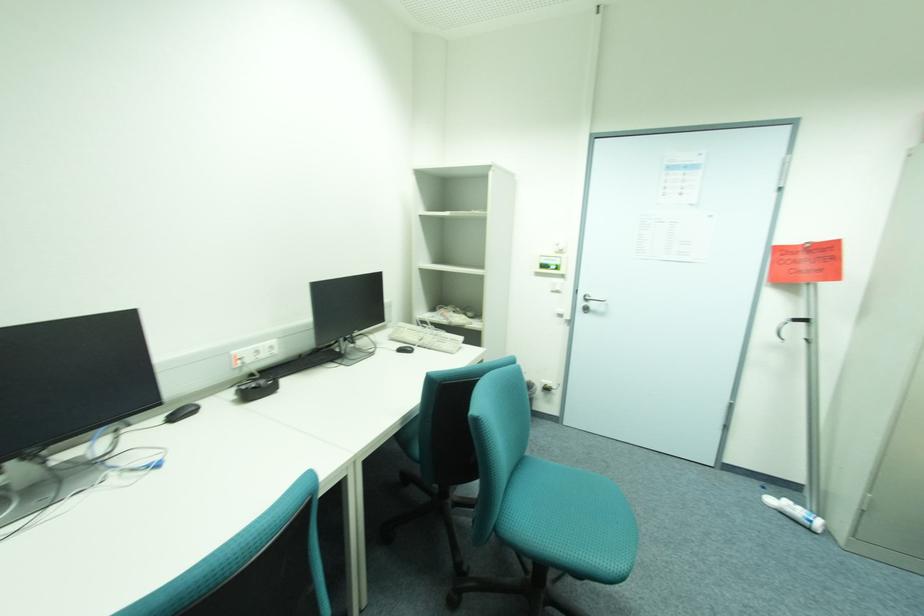
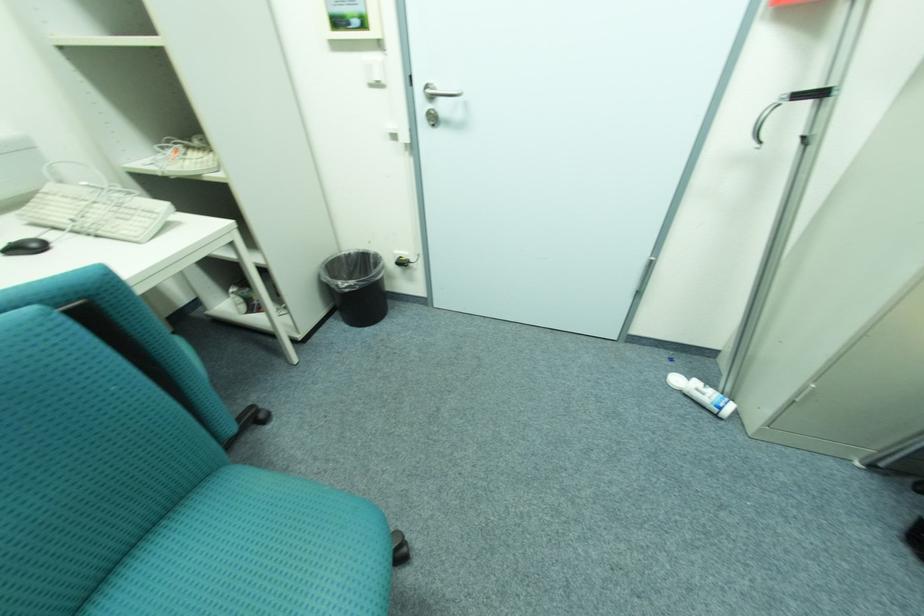
Which direction would the cameraman need to move to produce the second image?

The cameraman walked toward right, forward.